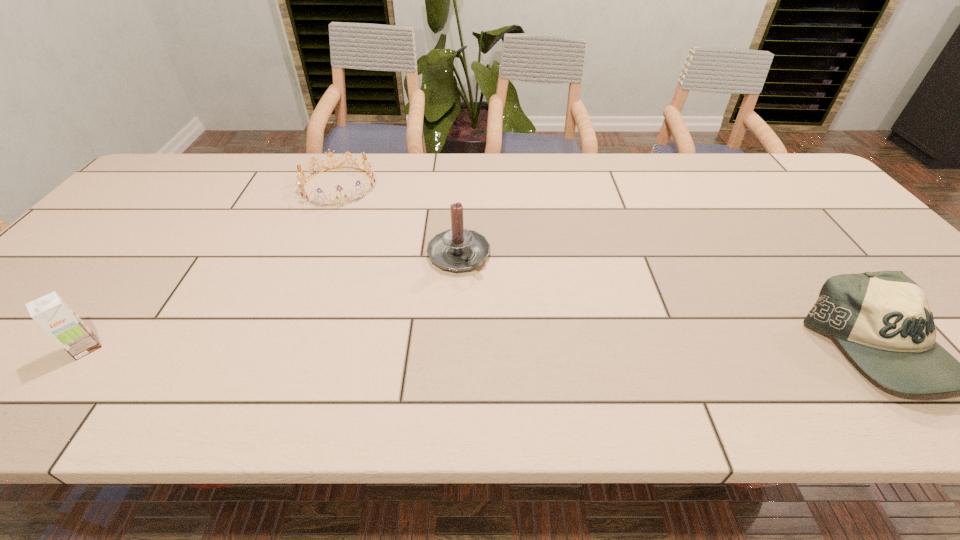
Image resolution: width=960 pixels, height=540 pixels. What are the coordinates of `vacant space situated on the side of the third nearest object with the handle loop` in the screenshot? It's located at (538, 333).

Locate an element on the screen. Image resolution: width=960 pixels, height=540 pixels. vacant region located on the side of the third nearest object with the handle loop is located at coordinates (498, 295).

Where is `object that is at the far edge`? object that is at the far edge is located at coordinates (371, 173).

Locate an element on the screen. This screenshot has height=540, width=960. object that is at the near edge is located at coordinates (50, 311).

Where is `vacant area at the far edge`? vacant area at the far edge is located at coordinates (545, 156).

In the image, there is a desktop. Where is `vacant area at the near edge`? The width and height of the screenshot is (960, 540). vacant area at the near edge is located at coordinates (695, 360).

This screenshot has width=960, height=540. I want to click on vacant area at the left edge of the desktop, so click(x=123, y=240).

Locate an element on the screen. free space at the right edge of the desktop is located at coordinates (826, 232).

Find the location of a particular element. vacant space in between the tiara and the leftmost object is located at coordinates (212, 267).

Find the location of `free point between the farthest object and the leftmost object`. free point between the farthest object and the leftmost object is located at coordinates pos(212,267).